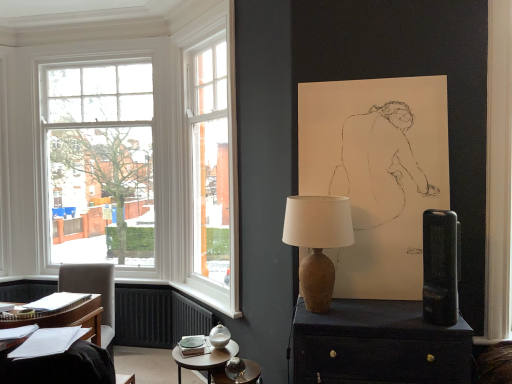
Image resolution: width=512 pixels, height=384 pixels. What are the coordinates of `empty space that is ontop of black plastic speaker at right (from a real-world perspective)` in the screenshot? It's located at (441, 214).